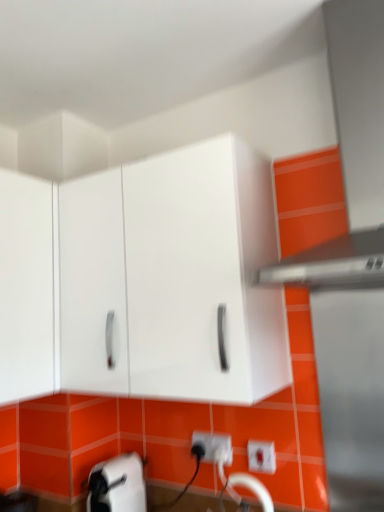
Question: Does white plastic electric outlet at lower center touch white glossy cabinet at upper center?

Choices:
 (A) no
 (B) yes

Answer: (A)

Question: Is white plastic electric outlet at lower center facing towards white glossy cabinet at upper center?

Choices:
 (A) yes
 (B) no

Answer: (B)

Question: Can you confirm if white plastic electric outlet at lower center is smaller than white glossy cabinet at upper center?

Choices:
 (A) yes
 (B) no

Answer: (A)

Question: Is the depth of white plastic electric outlet at lower center greater than that of white glossy cabinet at upper center?

Choices:
 (A) yes
 (B) no

Answer: (A)

Question: Can you confirm if white plastic electric outlet at lower center is positioned to the left of white glossy cabinet at upper center?

Choices:
 (A) yes
 (B) no

Answer: (B)

Question: In terms of width, does satin silver exhaust hood at upper right look wider or thinner when compared to white glossy cabinet at upper center?

Choices:
 (A) wide
 (B) thin

Answer: (A)

Question: Does point (377, 82) appear closer or farther from the camera than point (178, 396)?

Choices:
 (A) farther
 (B) closer

Answer: (B)

Question: Considering their positions, is satin silver exhaust hood at upper right located in front of or behind white glossy cabinet at upper center?

Choices:
 (A) behind
 (B) front

Answer: (B)

Question: Is satin silver exhaust hood at upper right taller or shorter than white glossy cabinet at upper center?

Choices:
 (A) short
 (B) tall

Answer: (B)

Question: Considering the positions of point (374, 253) and point (231, 452), is point (374, 253) closer or farther from the camera than point (231, 452)?

Choices:
 (A) farther
 (B) closer

Answer: (B)

Question: Would you say satin silver exhaust hood at upper right is to the left or to the right of white plastic electric outlet at lower center in the picture?

Choices:
 (A) left
 (B) right

Answer: (B)

Question: Is satin silver exhaust hood at upper right inside or outside of white plastic electric outlet at lower center?

Choices:
 (A) outside
 (B) inside

Answer: (A)

Question: From the image's perspective, is satin silver exhaust hood at upper right above or below white plastic electric outlet at lower center?

Choices:
 (A) above
 (B) below

Answer: (A)

Question: In terms of width, does white glossy cabinet at upper center look wider or thinner when compared to white plastic electric outlet at lower center?

Choices:
 (A) thin
 (B) wide

Answer: (B)

Question: Which is correct: white glossy cabinet at upper center is inside white plastic electric outlet at lower center, or outside of it?

Choices:
 (A) inside
 (B) outside

Answer: (B)